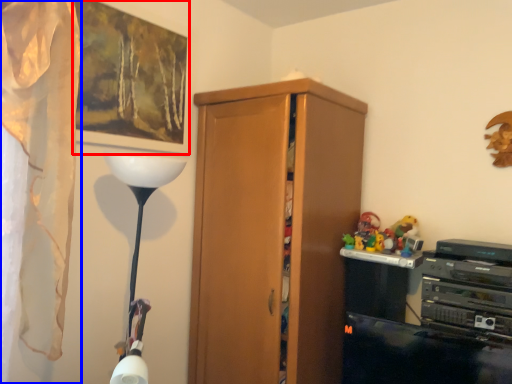
Question: Which object appears farthest to the camera in this image, picture frame (highlighted by a red box) or curtain (highlighted by a blue box)?

Choices:
 (A) picture frame
 (B) curtain

Answer: (A)